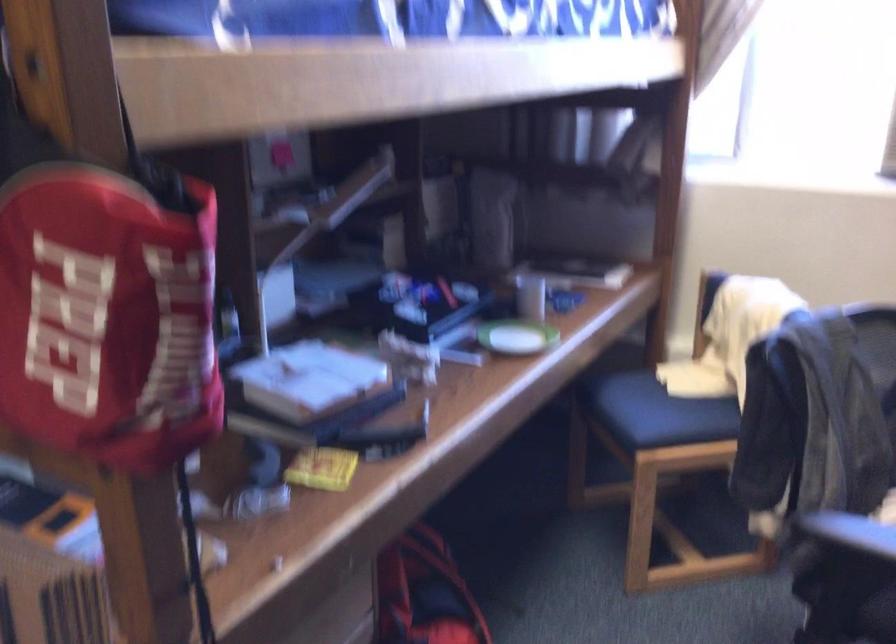
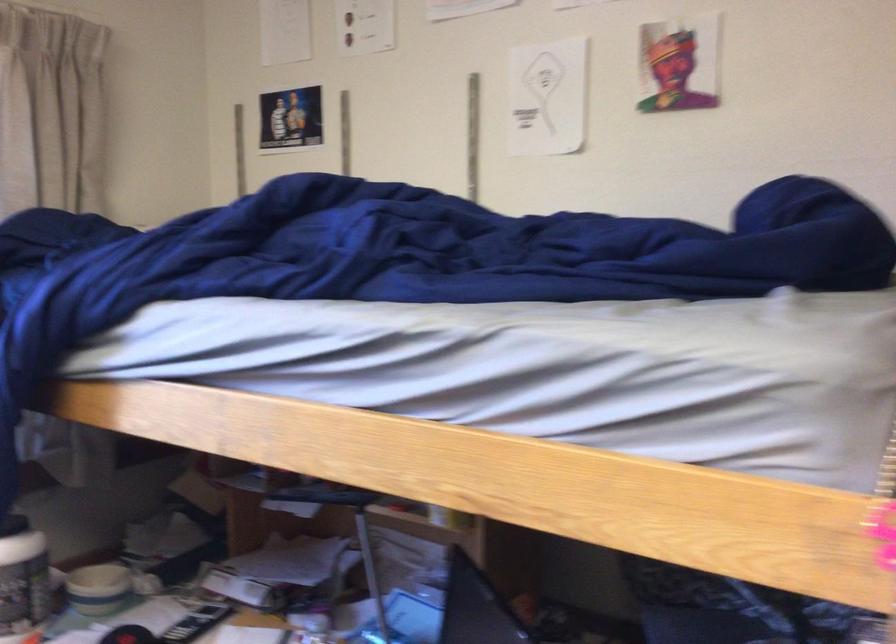
Question: The first image is from the beginning of the video and the second image is from the end. How did the camera likely rotate when shooting the video?

Choices:
 (A) Left
 (B) Right
 (C) Up
 (D) Down

Answer: (B)